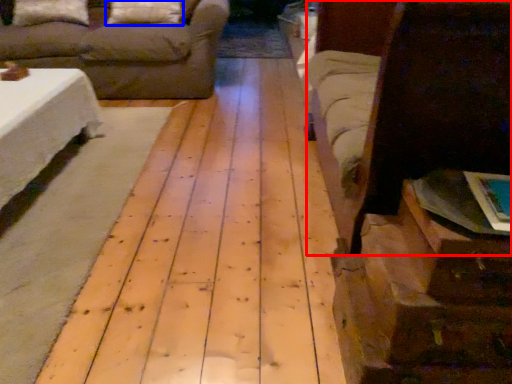
Question: Which point is closer to the camera, bed (highlighted by a red box) or pillow (highlighted by a blue box)?

Choices:
 (A) bed
 (B) pillow

Answer: (A)